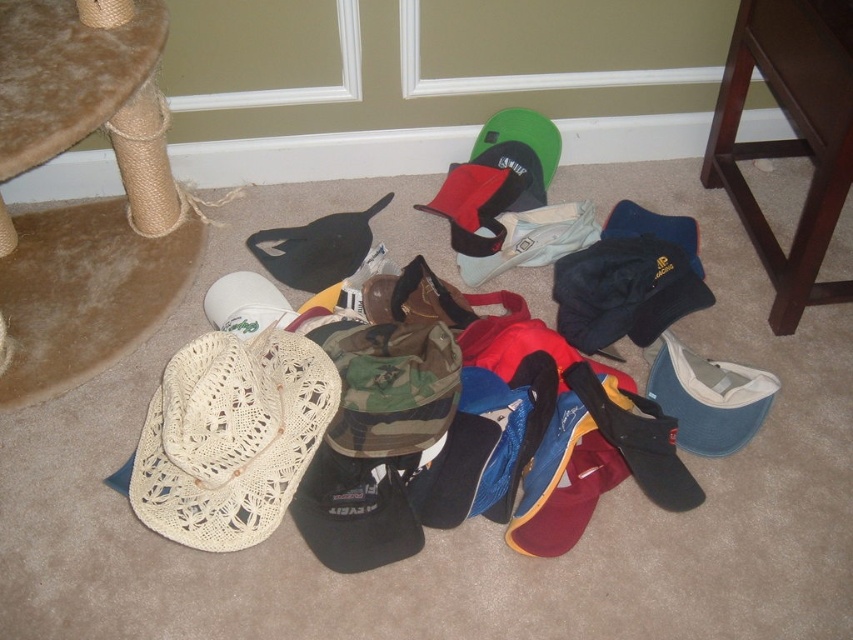
The height and width of the screenshot is (640, 853). What do you see at coordinates (230, 436) in the screenshot? I see `woven straw cowboy hat at lower left` at bounding box center [230, 436].

Can you confirm if woven straw cowboy hat at lower left is wider than velvet-like brown stool at upper left?

Yes, woven straw cowboy hat at lower left is wider than velvet-like brown stool at upper left.

Is point (137, 497) less distant than point (59, 45)?

Yes, it is.

Image resolution: width=853 pixels, height=640 pixels. Find the location of `woven straw cowboy hat at lower left`. woven straw cowboy hat at lower left is located at coordinates (230, 436).

Consider the image. Is velvet-like brown stool at upper left shorter than dark wood stool at lower right?

Correct, velvet-like brown stool at upper left is not as tall as dark wood stool at lower right.

Is velvet-like brown stool at upper left positioned before dark wood stool at lower right?

Yes, it is in front of dark wood stool at lower right.

Does point (152, 4) come farther from viewer compared to point (708, 140)?

No, it is in front of (708, 140).

Identify the location of velvet-like brown stool at upper left. (86, 92).

Can you confirm if woven straw cowboy hat at lower left is bigger than dark wood stool at lower right?

No, woven straw cowboy hat at lower left is not bigger than dark wood stool at lower right.

Which is in front, point (230, 515) or point (751, 218)?

Point (230, 515) is in front.

Identify the location of woven straw cowboy hat at lower left. The width and height of the screenshot is (853, 640). (230, 436).